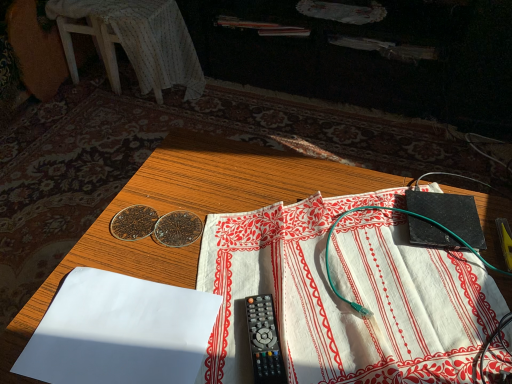
Find the location of a particular element. spots to the right of white paper at lower left, the 2th sheet from the right is located at coordinates (266, 297).